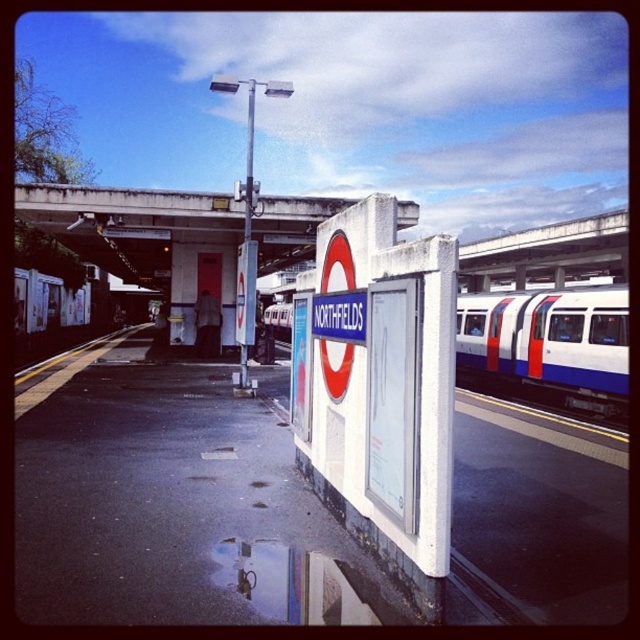
You are a commuter waiting at the Northfields station platform. You notice a white glossy passenger train at right and concrete at upper center. Which object takes up more area on the platform?

The concrete at upper center takes up more area on the platform than the white glossy passenger train at right.

You are a commuter waiting on the platform at Northfields station. You notice a white concrete signboard at center and a white glossy passenger train at right. Which object is larger in size?

The white concrete signboard at center is bigger than the white glossy passenger train at right.

You are waiting at the Northfields Underground station and notice a white concrete signboard at center and a white glossy passenger train at right. Which object is taller?

The white concrete signboard at center is much taller than the white glossy passenger train at right.